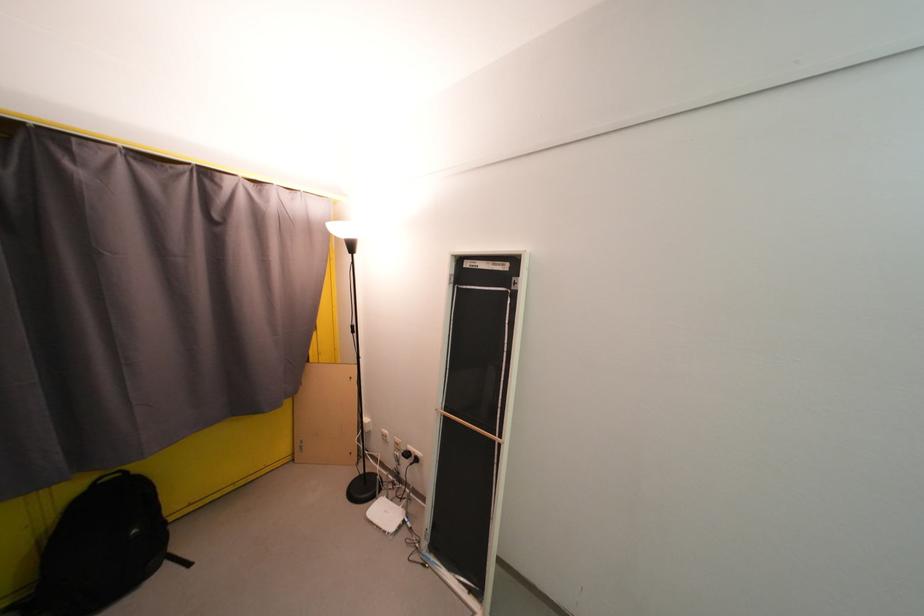
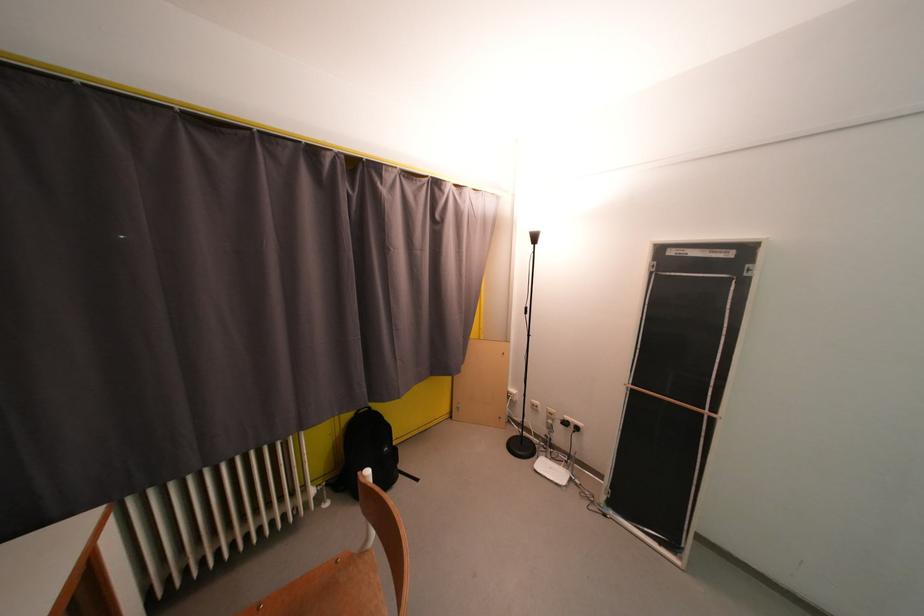
Locate, in the second image, the point that corresponds to pixel 415 456 in the first image.

(573, 427)